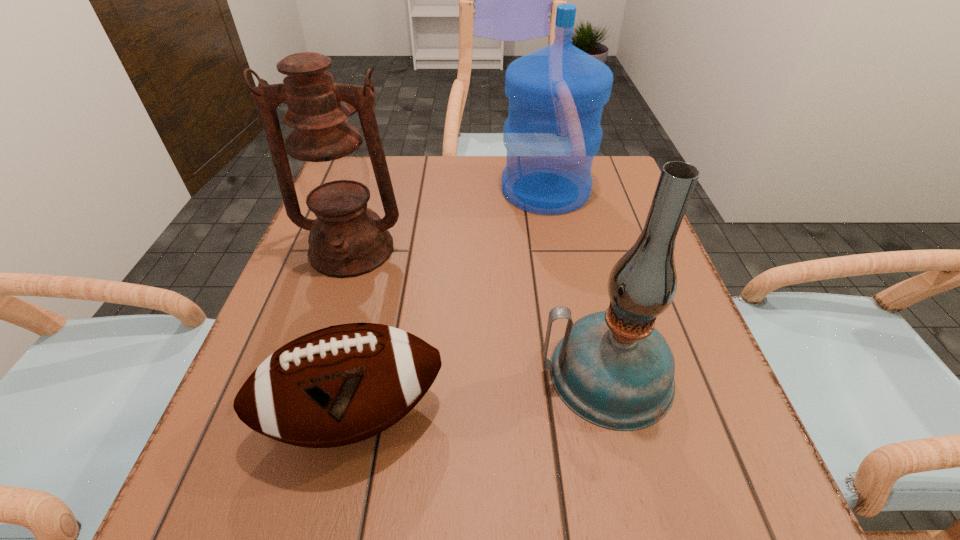
Identify the location of the farthest object. (556, 94).

Image resolution: width=960 pixels, height=540 pixels. What are the coordinates of `the second farthest object` in the screenshot? It's located at (347, 239).

This screenshot has width=960, height=540. Identify the location of the left oil lamp. (347, 239).

You are a GUI agent. You are given a task and a screenshot of the screen. Output one action in this format:
    pyautogui.click(x=<x>, y=<y>)
    Task: Click on the right oil lamp
    
    Given the screenshot: What is the action you would take?
    pyautogui.click(x=614, y=369)

This screenshot has height=540, width=960. In order to click on football (American) in this screenshot , I will do `click(339, 385)`.

Identify the location of free space located on the front of the farthest object. (559, 261).

Find the location of a particular element. This screenshot has width=960, height=540. free space located on the right of the left oil lamp is located at coordinates tap(464, 249).

You are a GUI agent. You are given a task and a screenshot of the screen. Output one action in this format:
    pyautogui.click(x=<x>, y=<y>)
    Task: Click on the vacant space located on the left of the right oil lamp
    The image size is (960, 540).
    Given the screenshot: What is the action you would take?
    pyautogui.click(x=416, y=374)

Where is `free space located 0.160m on the back of the football (American)`? Image resolution: width=960 pixels, height=540 pixels. free space located 0.160m on the back of the football (American) is located at coordinates (380, 297).

I want to click on object at the far edge, so [556, 94].